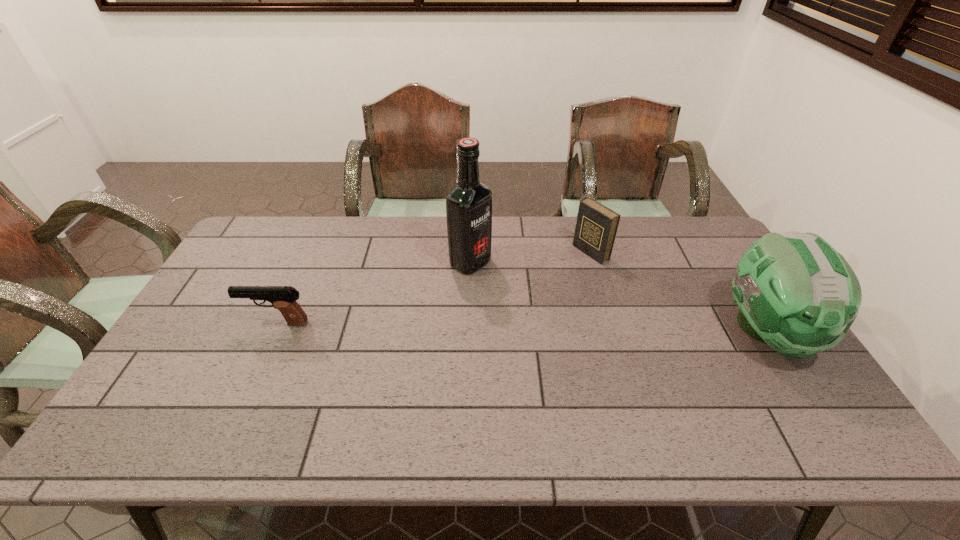
Locate an element on the screen. This screenshot has width=960, height=540. vacant spot on the desktop that is between the pistol and the football helmet and is positioned on the front cover of the third object from left to right is located at coordinates (456, 326).

At what (x,y) coordinates should I click in order to perform the action: click on vacant space on the desktop that is between the shortest object and the second tallest object and is positioned on the front-facing side of the tallest object. Please return your answer as a coordinate pair (x, y). Image resolution: width=960 pixels, height=540 pixels. Looking at the image, I should click on (586, 328).